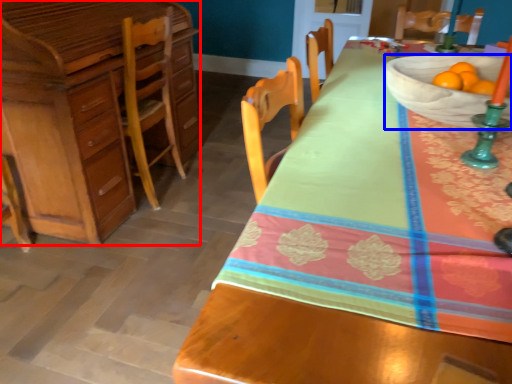
Question: Among these objects, which one is nearest to the camera, cabinetry (highlighted by a red box) or bowl (highlighted by a blue box)?

Choices:
 (A) cabinetry
 (B) bowl

Answer: (B)